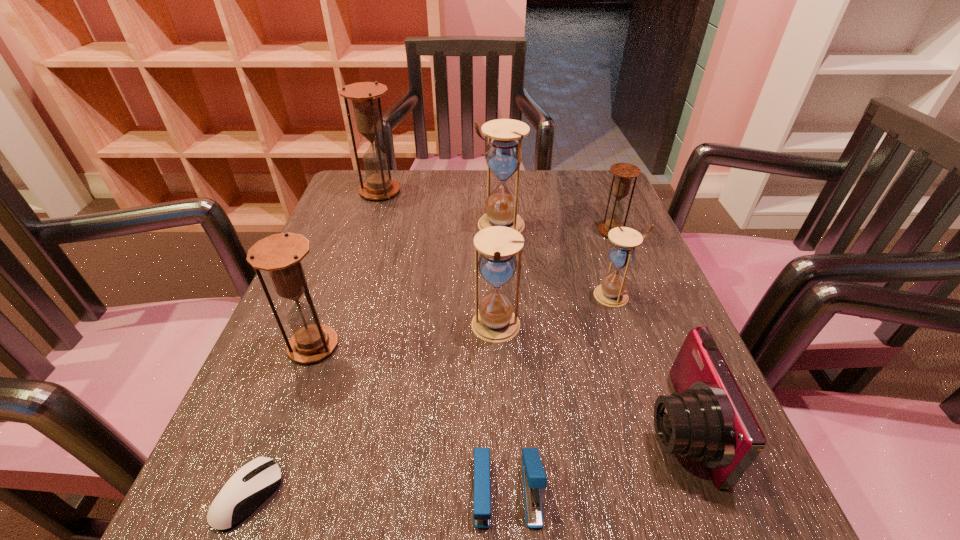
Locate an element on the screen. This screenshot has height=540, width=960. object at the near left corner is located at coordinates (255, 481).

Where is `object situated at the near right corner`? The image size is (960, 540). object situated at the near right corner is located at coordinates (708, 419).

Locate an element on the screen. vacant space at the far edge of the desktop is located at coordinates (457, 184).

Image resolution: width=960 pixels, height=540 pixels. I want to click on vacant point at the near edge, so click(x=502, y=535).

This screenshot has height=540, width=960. I want to click on free space at the left edge of the desktop, so click(x=349, y=265).

You are a GUI agent. You are given a task and a screenshot of the screen. Output one action in this format:
    pyautogui.click(x=<x>, y=<y>)
    Task: Click on the vacant space at the right edge
    
    Given the screenshot: What is the action you would take?
    pyautogui.click(x=644, y=362)

Image resolution: width=960 pixels, height=540 pixels. In order to click on vacant space at the far left corner of the desktop in this screenshot , I will do `click(350, 197)`.

Find the location of a particular element. vacant area at the near left corner is located at coordinates (201, 505).

In the image, there is a desktop. Where is `vacant space at the far right corner`? The width and height of the screenshot is (960, 540). vacant space at the far right corner is located at coordinates (597, 177).

Find the location of a particular element. This screenshot has height=540, width=960. free spot between the farthest hourglass and the second biggest white hourglass is located at coordinates (438, 260).